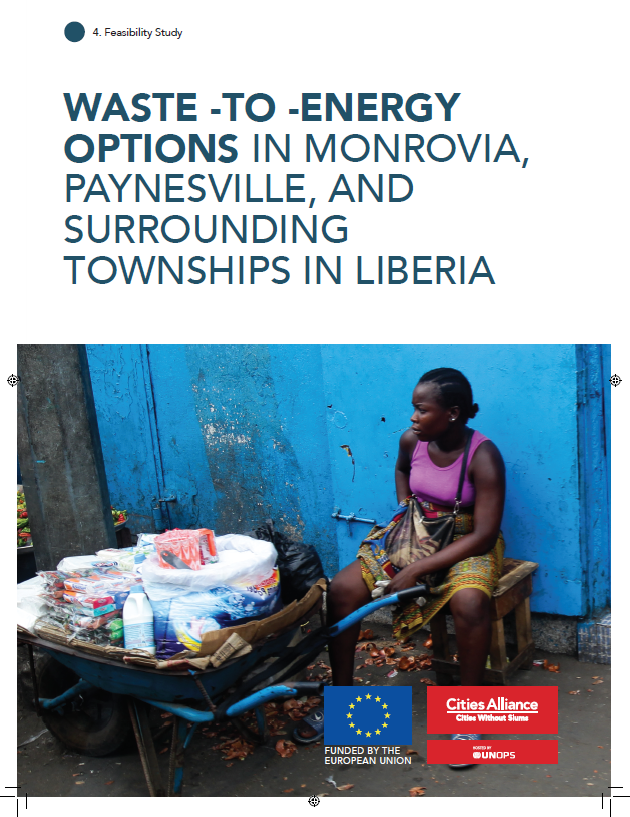
Where is `wooden stool`? This screenshot has width=630, height=817. wooden stool is located at coordinates (513, 600).